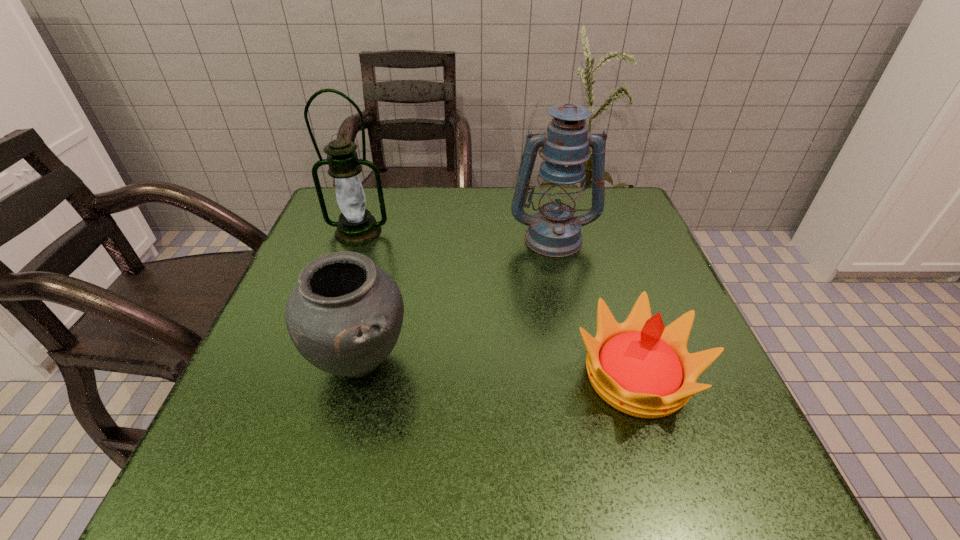
Locate an element on the screen. lantern present at the right edge is located at coordinates (554, 231).

Where is `crown that is at the right edge`? crown that is at the right edge is located at coordinates (640, 367).

I want to click on object that is at the far left corner, so click(x=356, y=226).

In order to click on object that is at the far right corner in this screenshot , I will do `click(554, 231)`.

Identify the location of vacant space at the far edge. The image size is (960, 540). (474, 222).

The image size is (960, 540). I want to click on vacant space at the near edge of the desktop, so click(x=484, y=461).

The height and width of the screenshot is (540, 960). What are the coordinates of `blank space at the left edge` in the screenshot? It's located at coord(267,424).

Where is `free space at the right edge of the desktop`? The height and width of the screenshot is (540, 960). free space at the right edge of the desktop is located at coordinates (714, 391).

The width and height of the screenshot is (960, 540). I want to click on vacant space at the far left corner, so (325, 223).

At what (x,y) coordinates should I click in order to perform the action: click on vacant region at the near left corner of the desktop. Please return your answer as a coordinate pair (x, y). Image resolution: width=960 pixels, height=540 pixels. Looking at the image, I should click on (270, 440).